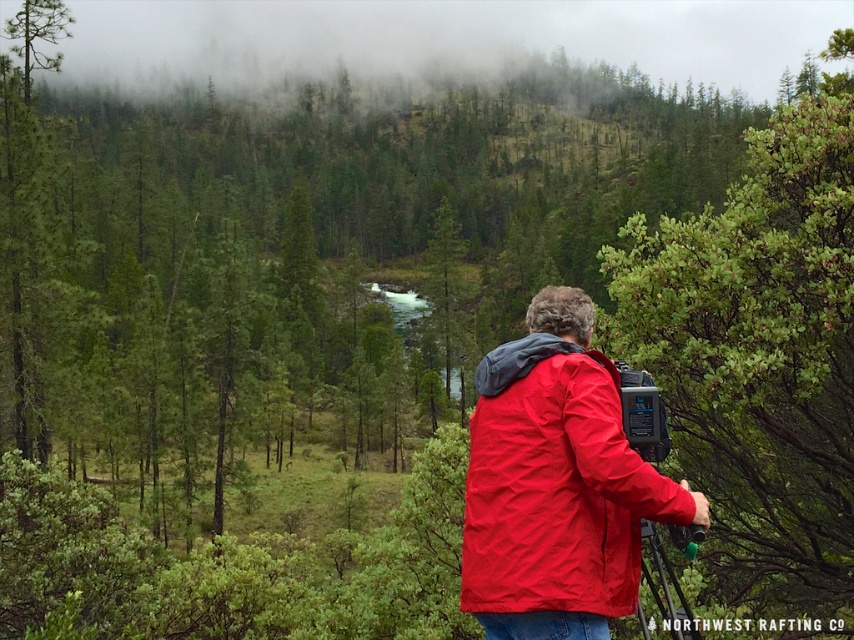
You are a photographer standing at the center of the scene. You want to move to the green leafy shrub at right without stepping on the metallic tripod at center. Which direction should you move?

You should move to the right to reach the green leafy shrub at right while avoiding the metallic tripod at center, as the shrub is positioned to the right of the tripod.

You are standing at point (759, 352). What object is located at this point?

The green leafy shrub at right is located at point (759, 352).